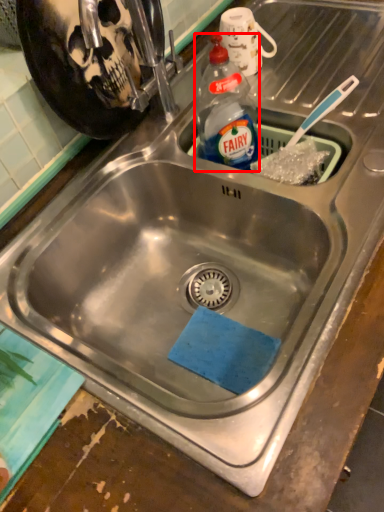
Question: From the image's perspective, where is bottle (annotated by the red box) located relative to mug?

Choices:
 (A) below
 (B) above

Answer: (A)